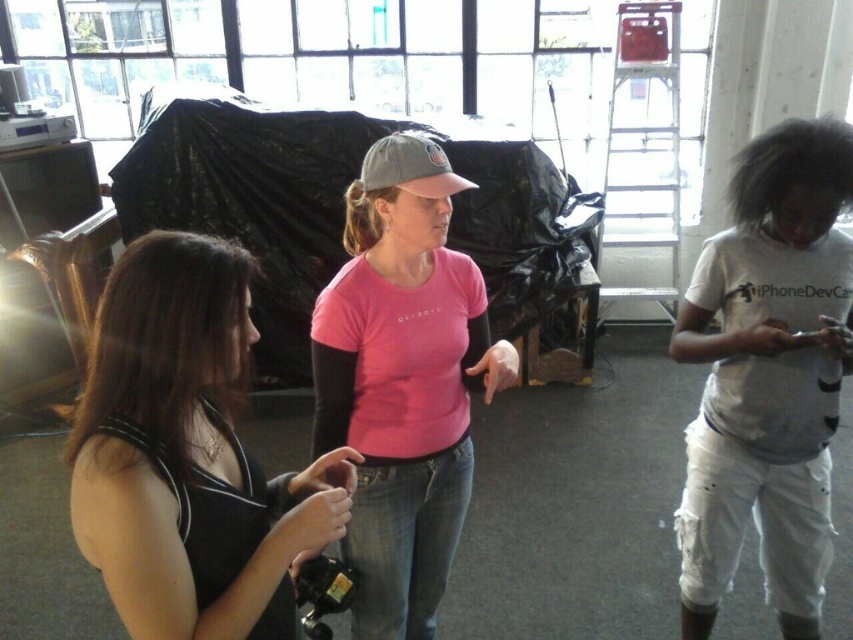
Question: Which object is the closest to the white cotton shirt at right?

Choices:
 (A) gray fabric baseball cap at center
 (B) black matte tank top at center
 (C) pink matte t-shirt at center

Answer: (C)

Question: Which object is the closest to the black matte tank top at center?

Choices:
 (A) gray fabric baseball cap at center
 (B) white cotton shirt at right
 (C) pink matte t-shirt at center

Answer: (C)

Question: Is white cotton shirt at right below gray fabric baseball cap at center?

Choices:
 (A) no
 (B) yes

Answer: (B)

Question: Does white cotton shirt at right have a larger size compared to gray fabric baseball cap at center?

Choices:
 (A) yes
 (B) no

Answer: (A)

Question: Is black matte tank top at center thinner than pink matte t-shirt at center?

Choices:
 (A) no
 (B) yes

Answer: (B)

Question: Which point is farther to the camera?

Choices:
 (A) (447, 179)
 (B) (380, 193)
 (C) (189, 422)

Answer: (B)